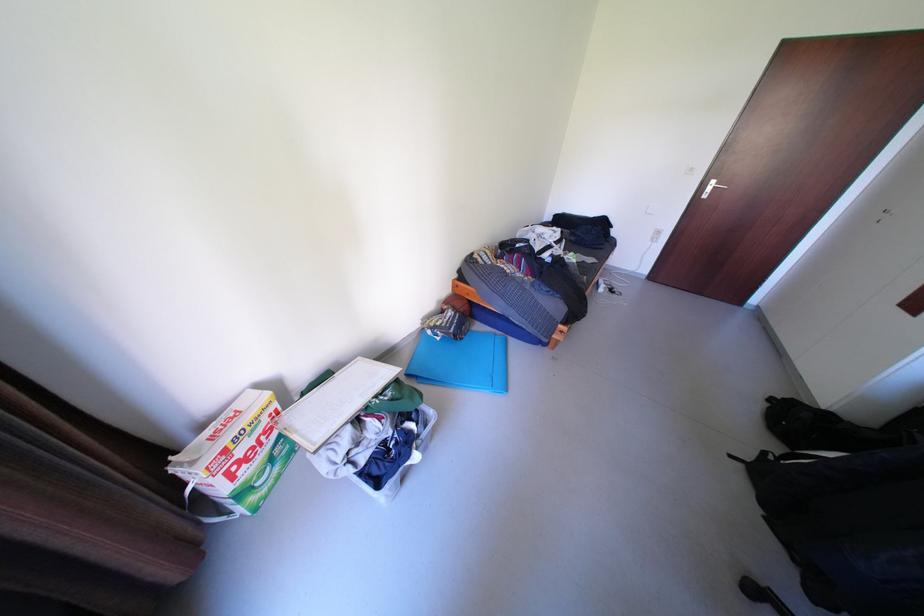
Describe the element at coordinates (655, 235) in the screenshot. The height and width of the screenshot is (616, 924). I see `the white power outlet` at that location.